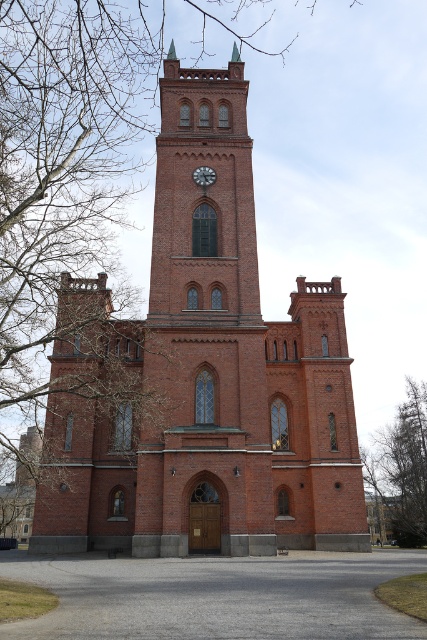
Is red brick church at center taller than white painted metal clock at upper center?

Indeed, red brick church at center has a greater height compared to white painted metal clock at upper center.

Is red brick church at center smaller than white painted metal clock at upper center?

Incorrect, red brick church at center is not smaller in size than white painted metal clock at upper center.

Is point (145, 550) more distant than point (205, 182)?

No, it is not.

The image size is (427, 640). In order to click on red brick church at center in this screenshot , I will do `click(204, 376)`.

What are the coordinates of `green leafy tree at right` in the screenshot? It's located at (401, 468).

Between green leafy tree at right and white painted metal clock at upper center, which one appears on the right side from the viewer's perspective?

green leafy tree at right is more to the right.

Between point (398, 541) and point (195, 179), which one is positioned behind?

The point (398, 541) is behind.

Find the location of a particular element. The height and width of the screenshot is (640, 427). green leafy tree at right is located at coordinates (401, 468).

Does red brick church at center appear over green leafy tree at right?

Indeed, red brick church at center is positioned over green leafy tree at right.

Is red brick church at center taller than green leafy tree at right?

Indeed, red brick church at center has a greater height compared to green leafy tree at right.

What do you see at coordinates (204, 376) in the screenshot? I see `red brick church at center` at bounding box center [204, 376].

In order to click on red brick church at center in this screenshot , I will do `click(204, 376)`.